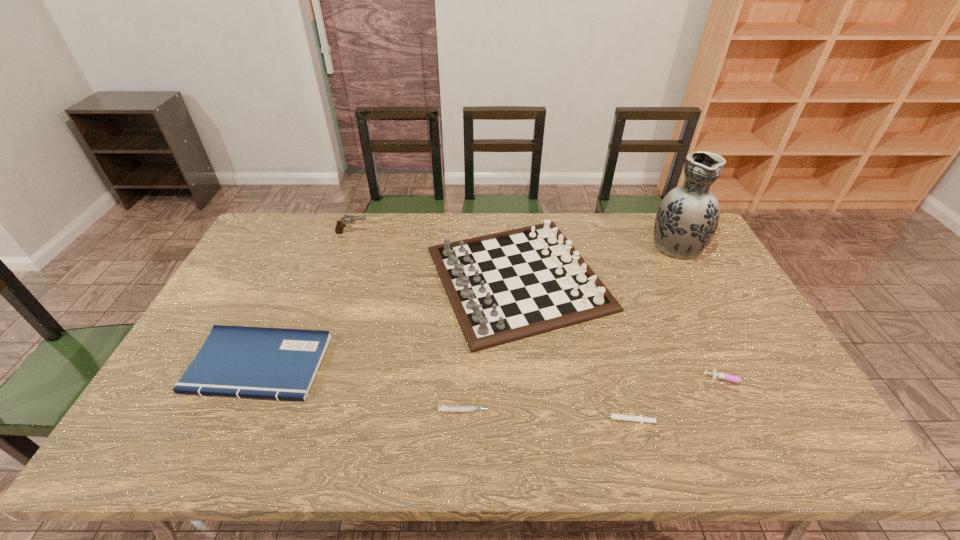
At what (x,y) coordinates should I click in order to perform the action: click on blank area located 0.080m on the left of the chessboard. Please return your answer as a coordinate pair (x, y). The image size is (960, 540). Looking at the image, I should click on (399, 279).

Where is `free location located 0.180m at the barrel of the pistol`? Image resolution: width=960 pixels, height=540 pixels. free location located 0.180m at the barrel of the pistol is located at coordinates (419, 233).

This screenshot has height=540, width=960. I want to click on free point located on the right of the fourth shortest object, so click(353, 364).

This screenshot has height=540, width=960. In order to click on free location located on the front of the rightmost syringe in this screenshot , I will do `click(758, 436)`.

Locate an element on the screen. free space located 0.340m at the needle end of the sixth tallest object is located at coordinates (631, 410).

I want to click on free point located on the back of the nearest syringe, so click(x=604, y=341).

The image size is (960, 540). In order to click on vase at the far edge in this screenshot , I will do `click(687, 217)`.

Identify the location of chessboard at the far edge. click(x=503, y=287).

This screenshot has height=540, width=960. What are the coordinates of `pistol located at the far edge` in the screenshot? It's located at (346, 219).

Find the location of a particular element. object at the near edge is located at coordinates (640, 419).